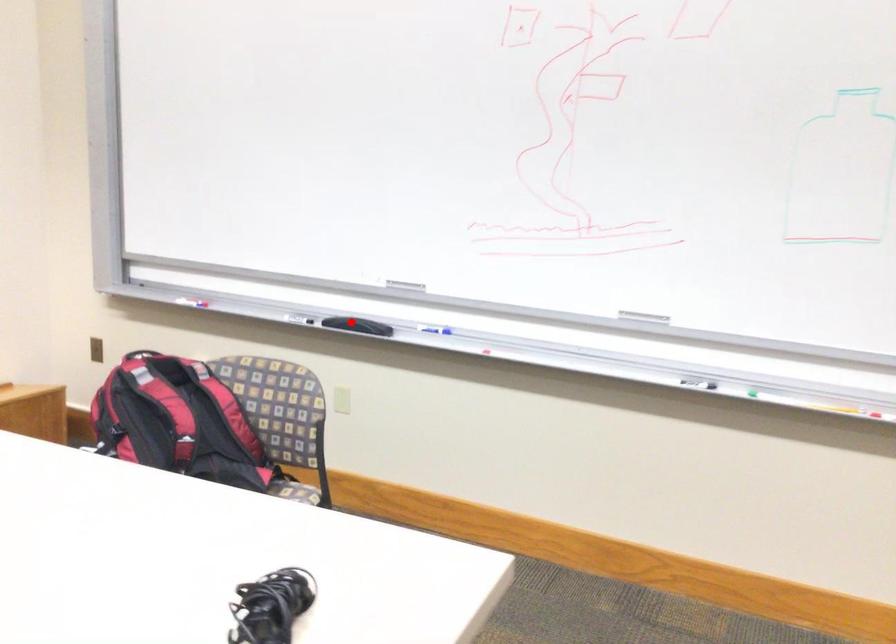
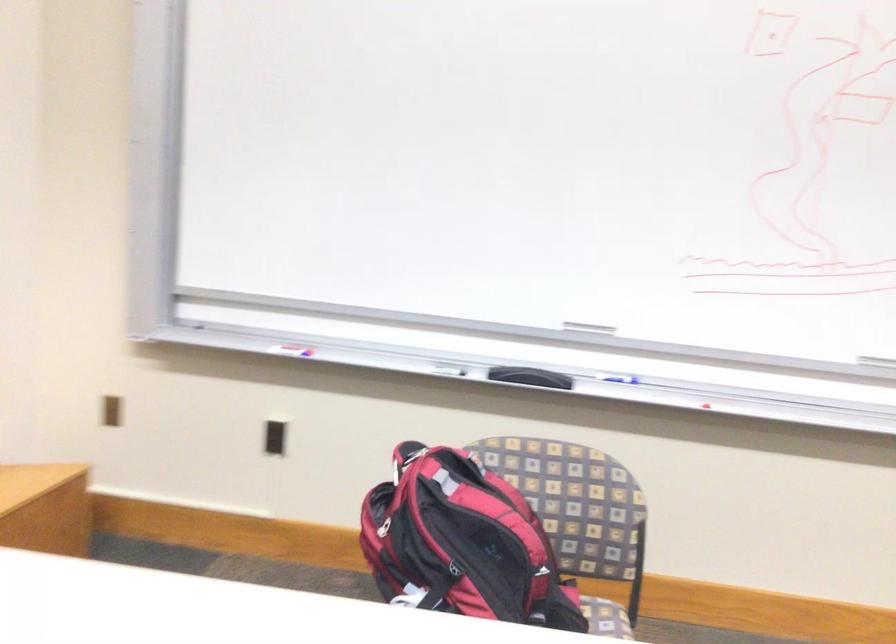
Question: A red point is marked in image1. In image2, is the corresponding 3D point closer to the camera or farther? Reply with the corresponding letter.

Choices:
 (A) The corresponding 3D point is closer.
 (B) The corresponding 3D point is farther.

Answer: (A)